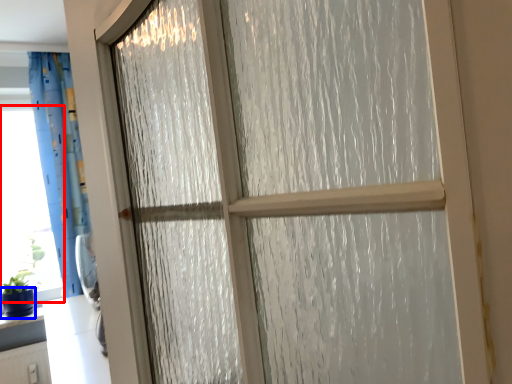
Question: Among these objects, which one is nearest to the camera, window screen (highlighted by a red box) or glass vase (highlighted by a blue box)?

Choices:
 (A) window screen
 (B) glass vase

Answer: (B)